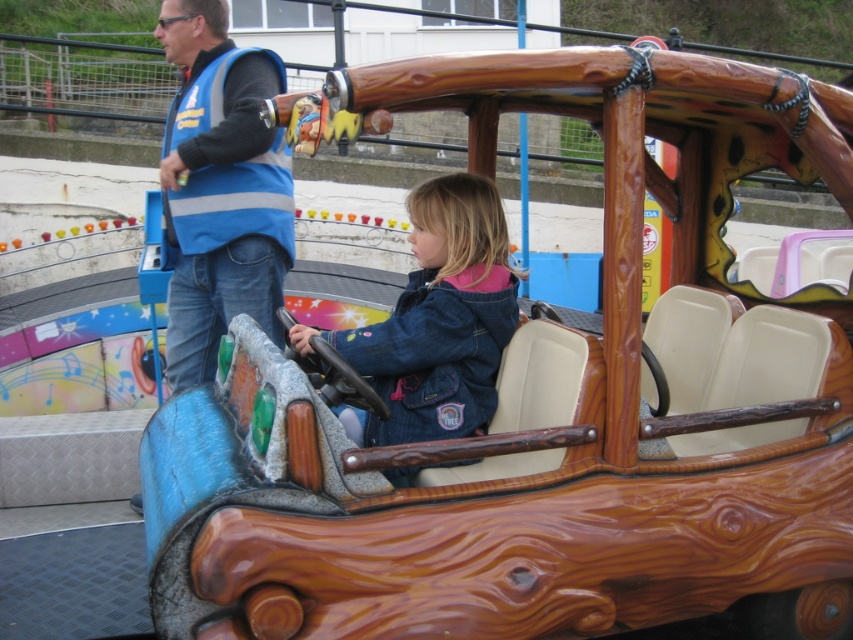
Question: Is blue reflective vest at upper left closer to camera compared to denim jacket at center?

Choices:
 (A) yes
 (B) no

Answer: (B)

Question: Which point is farther to the camera?

Choices:
 (A) (277, 250)
 (B) (426, 336)

Answer: (A)

Question: Does blue reflective vest at upper left have a smaller size compared to denim jacket at center?

Choices:
 (A) no
 (B) yes

Answer: (B)

Question: Which object is closer to the camera taking this photo?

Choices:
 (A) denim jacket at center
 (B) blue reflective vest at upper left

Answer: (A)

Question: Is blue reflective vest at upper left bigger than denim jacket at center?

Choices:
 (A) no
 (B) yes

Answer: (A)